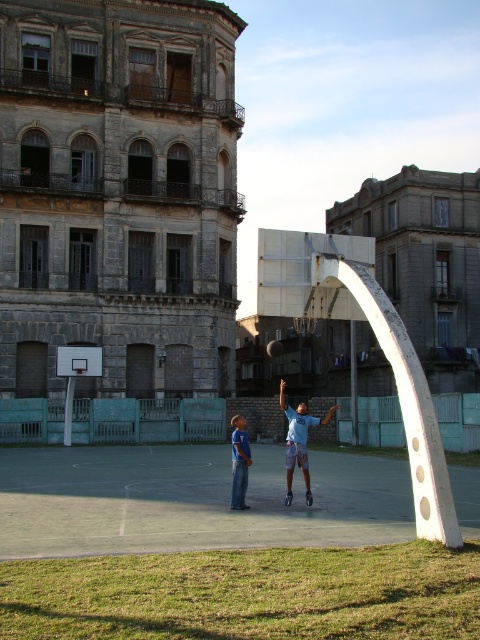
Question: Which object appears closest to the camera in this image?

Choices:
 (A) light blue jersey at center
 (B) smooth concrete court at center
 (C) blue cotton shirt at center

Answer: (B)

Question: Which object is closer to the camera taking this photo?

Choices:
 (A) light blue jersey at center
 (B) smooth concrete court at center
 (C) white glossy basketball hoop at left
 (D) blue cotton shirt at center

Answer: (B)

Question: Does smooth concrete court at center have a larger size compared to light blue jersey at center?

Choices:
 (A) yes
 (B) no

Answer: (B)

Question: Does smooth concrete court at center appear on the right side of blue cotton shirt at center?

Choices:
 (A) no
 (B) yes

Answer: (A)

Question: Based on their relative distances, which object is nearer to the blue cotton shirt at center?

Choices:
 (A) white glossy basketball hoop at left
 (B) light blue jersey at center
 (C) smooth concrete court at center

Answer: (B)

Question: Can you confirm if smooth concrete court at center is thinner than blue cotton shirt at center?

Choices:
 (A) no
 (B) yes

Answer: (A)